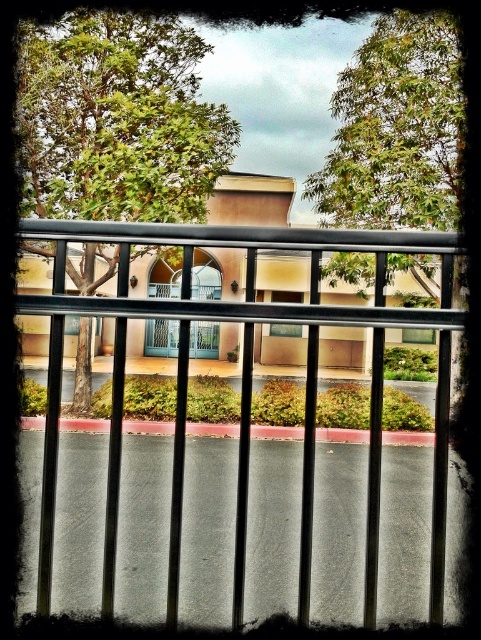
You are standing behind the black metal fence at center and want to see the green leafy tree at center. Can you see the top of the tree over the fence?

The black metal fence at center is shorter than the green leafy tree at center, so yes, you can see the top of the green leafy tree at center over the fence.

You are a painter standing at the metal railing. You want to paint the green leafy tree at upper center, but you notice the black metal fence at center is blocking your view. Can you paint the tree without moving your position?

The black metal fence at center has a lesser height compared to green leafy tree at upper center, so yes, you can paint the tree without moving your position because the tree is taller and visible above the fence.

You are standing behind the metal railing and looking at the two green leafy trees in the scene. Which tree is closer to you, the green leafy tree at center or the green leafy tree at upper center?

Answer: The green leafy tree at center is closer to you because it is positioned over the green leafy tree at upper center, meaning it is in front of it.